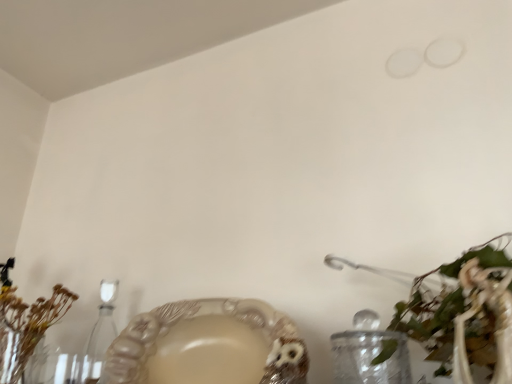
Question: Is clear glass candle holder at lower left wider or thinner than matte beige bowl at lower center?

Choices:
 (A) wide
 (B) thin

Answer: (B)

Question: Based on their positions, is clear glass candle holder at lower left located to the left or right of matte beige bowl at lower center?

Choices:
 (A) right
 (B) left

Answer: (B)

Question: Based on their relative distances, which object is farther from the brown dried flowers at left, which is the first floral arrangement in left-to-right order?

Choices:
 (A) matte beige bowl at lower center
 (B) clear glass candle holder at lower left
 (C) green leafy plant at lower right, arranged as the 2th floral arrangement when viewed from the back

Answer: (C)

Question: Estimate the real-world distances between objects in this image. Which object is farther from the clear glass candle holder at lower left?

Choices:
 (A) matte beige bowl at lower center
 (B) brown dried flowers at left, which is the first floral arrangement in left-to-right order
 (C) green leafy plant at lower right, the 1th floral arrangement in the front-to-back sequence

Answer: (C)